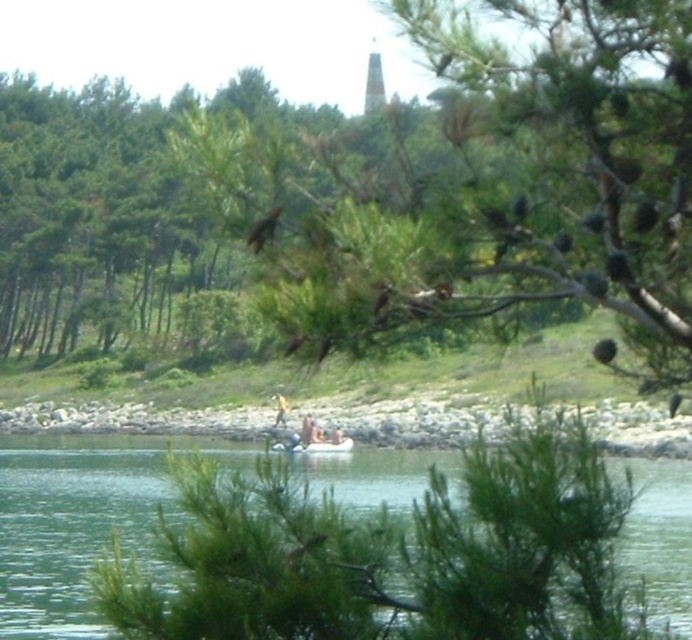
You are planning to cross the lake from the gray rocky shoreline at lower center to the green water at center. Based on the scene description, which area is narrower?

The green water at center has a lesser width compared to the gray rocky shoreline at lower center, so the green water at center is narrower.

You are standing at the edge of the lake and want to take a photo of the green water at center and the gray rocky shoreline at lower center. Which object will appear taller in your photo?

The green water at center will appear taller in the photo because it has a greater height compared to the gray rocky shoreline at lower center.